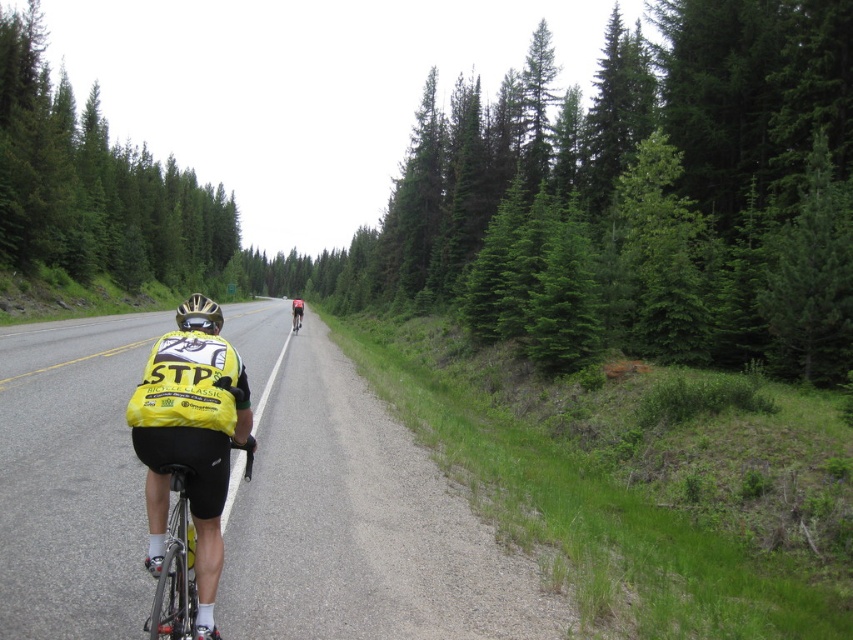
Question: Among these objects, which one is nearest to the camera?

Choices:
 (A) smooth asphalt road at center
 (B) red matte bicycle at center

Answer: (A)

Question: Estimate the real-world distances between objects in this image. Which object is farther from the red matte bicycle at center?

Choices:
 (A) green evergreen trees at left
 (B) black matte bicycle at center

Answer: (A)

Question: Can you confirm if smooth asphalt road at center is wider than black matte bicycle at center?

Choices:
 (A) yes
 (B) no

Answer: (A)

Question: Does smooth asphalt road at center have a lesser width compared to shiny metallic bicycle at center?

Choices:
 (A) no
 (B) yes

Answer: (A)

Question: Is black matte bicycle helmet at center bigger than shiny metallic bicycle at center?

Choices:
 (A) yes
 (B) no

Answer: (A)

Question: Among these points, which one is nearest to the camera?

Choices:
 (A) (184, 316)
 (B) (85, 387)
 (C) (38, 176)
 (D) (300, 300)

Answer: (A)